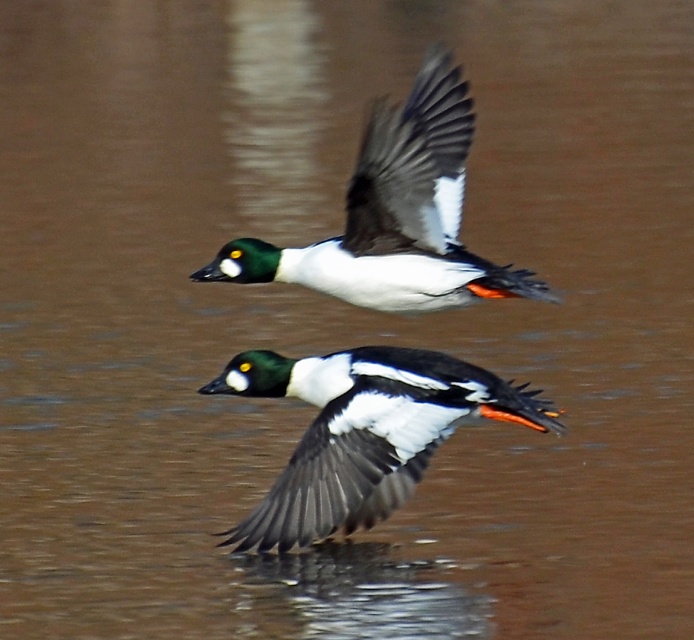
Does shiny black duck at center lie in front of shiny black duck at upper center?

No, shiny black duck at center is further to the viewer.

The image size is (694, 640). I want to click on shiny black duck at center, so click(x=363, y=432).

This screenshot has height=640, width=694. In order to click on shiny black duck at center in this screenshot , I will do pos(363,432).